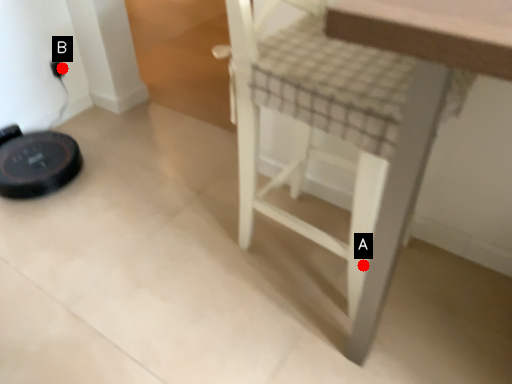
Question: Two points are circled on the image, labeled by A and B beside each circle. Which point is closer to the camera?

Choices:
 (A) A is closer
 (B) B is closer

Answer: (A)